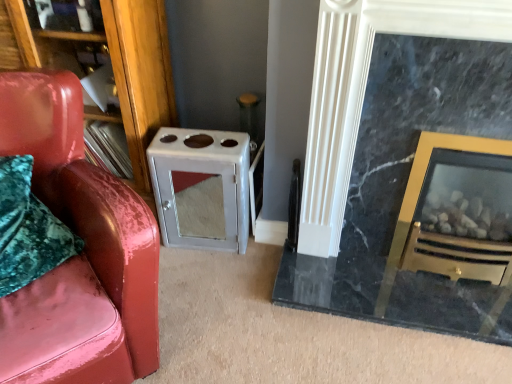
This screenshot has height=384, width=512. I want to click on unoccupied area in front of satin silver cabinet at center, so coord(205,281).